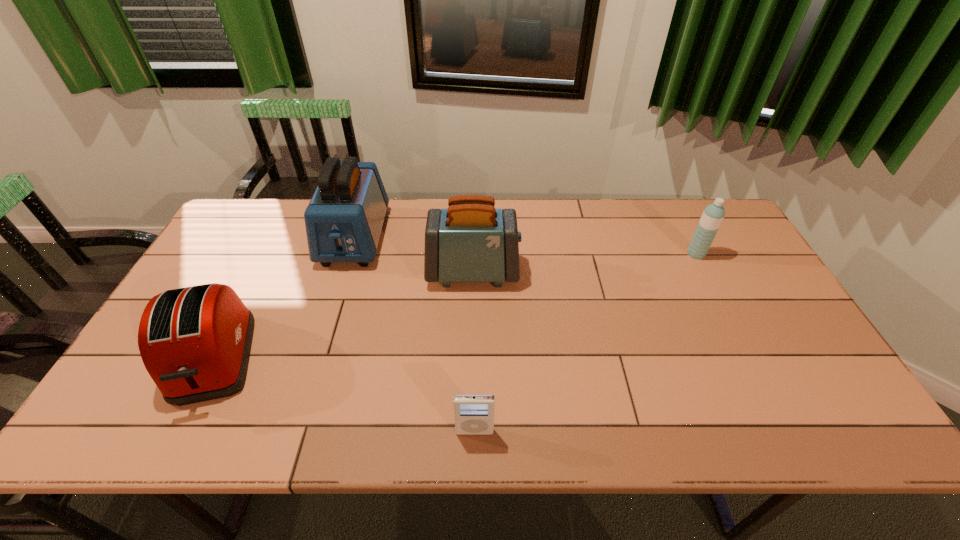
This screenshot has width=960, height=540. Find the location of `vacant space at the right edge`. vacant space at the right edge is located at coordinates (795, 328).

I want to click on vacant space at the far left corner of the desktop, so click(280, 221).

Where is `free space at the near left corner of the desktop`? free space at the near left corner of the desktop is located at coordinates (145, 416).

Identify the location of vacant space at the far right corner. The width and height of the screenshot is (960, 540). (686, 228).

Where is `empty location between the second toaster from left to right and the shortest object`? Image resolution: width=960 pixels, height=540 pixels. empty location between the second toaster from left to right and the shortest object is located at coordinates (415, 334).

Where is `vacant area that lies between the rightmost object and the rightmost toaster`? This screenshot has width=960, height=540. vacant area that lies between the rightmost object and the rightmost toaster is located at coordinates (585, 263).

Identify the location of vacant space in between the shortest object and the second toaster from right to left. (415, 334).

Locate an element on the screen. vacant space that's between the shortest object and the second object from left to right is located at coordinates (415, 334).

Locate an element on the screen. The width and height of the screenshot is (960, 540). free point between the rightmost toaster and the second object from left to right is located at coordinates (414, 254).

At what (x,y) coordinates should I click in order to perform the action: click on vacant space that's between the second toaster from right to left and the shortest object. Please return your answer as a coordinate pair (x, y). Looking at the image, I should click on (415, 334).